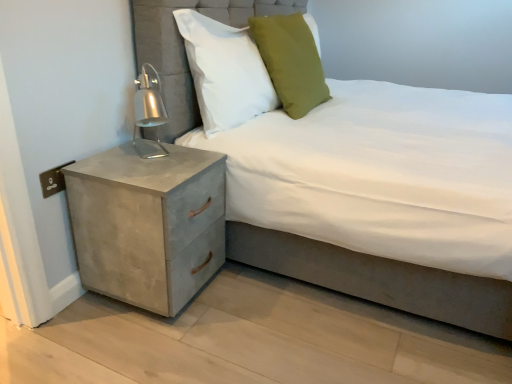
Identify the location of free space in front of concrete textured nightstand at lower left. The image size is (512, 384). (133, 347).